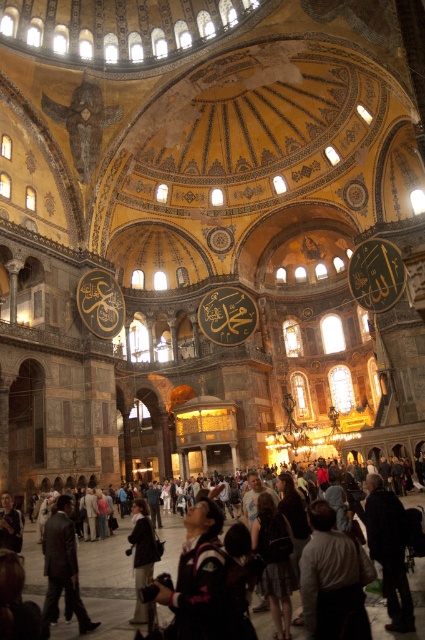
Question: Among these objects, which one is farthest from the camera?

Choices:
 (A) dark gray fabric jacket at lower center
 (B) dark fabric coat at lower right
 (C) dark clothing crowd at lower center

Answer: (A)

Question: Which of the following is the closest to the observer?

Choices:
 (A) dark gray fabric jacket at lower center
 (B) white cotton shirt at center
 (C) dark brown leather backpack at center

Answer: (B)

Question: Considering the relative positions of dark clothing crowd at lower center and dark gray fabric jacket at lower center in the image provided, where is dark clothing crowd at lower center located with respect to dark gray fabric jacket at lower center?

Choices:
 (A) left
 (B) right

Answer: (B)

Question: Which point is closer to the camera taking this photo?

Choices:
 (A) (337, 531)
 (B) (377, 486)
 (C) (261, 545)
 (D) (396, 637)

Answer: (D)

Question: Can you confirm if white cotton shirt at center is positioned below dark brown leather backpack at center?

Choices:
 (A) yes
 (B) no

Answer: (B)

Question: Is dark clothing crowd at lower center thinner than dark brown leather backpack at center?

Choices:
 (A) yes
 (B) no

Answer: (B)